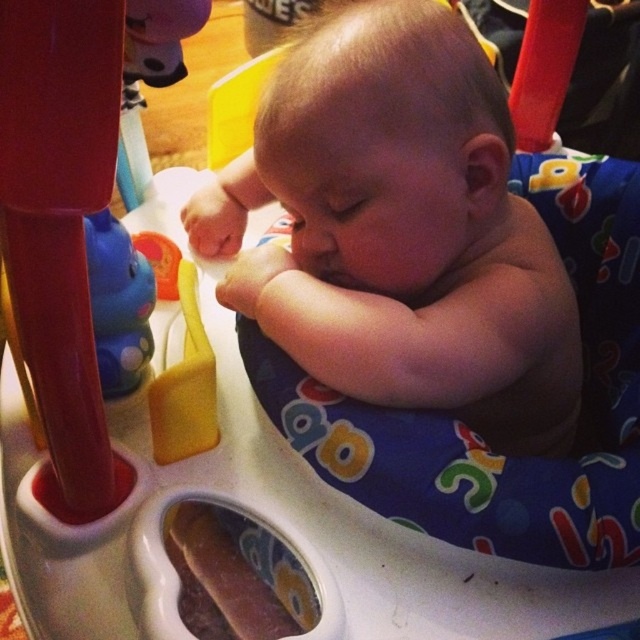
Can you confirm if blue rubber toy at left is shorter than rubberized plastic toy at left?

In fact, blue rubber toy at left may be taller than rubberized plastic toy at left.

Can you confirm if blue rubber toy at left is thinner than rubberized plastic toy at left?

Yes.

Which is behind, point (145, 355) or point (161, 298)?

The point (161, 298) is behind.

This screenshot has width=640, height=640. Identify the location of blue rubber toy at left. (118, 305).

Can you confirm if smooth skin baby at center is bigger than rubberized plastic toy at left?

Yes, smooth skin baby at center is bigger than rubberized plastic toy at left.

Does smooth skin baby at center have a greater width compared to rubberized plastic toy at left?

Indeed, smooth skin baby at center has a greater width compared to rubberized plastic toy at left.

Which is in front, point (372, 232) or point (154, 257)?

Point (372, 232)

Identify the location of smooth skin baby at center. (401, 230).

Which of these two, smooth skin baby at center or blue rubber toy at left, stands shorter?

With less height is blue rubber toy at left.

Is smooth skin baby at center to the left of blue rubber toy at left from the viewer's perspective?

In fact, smooth skin baby at center is to the right of blue rubber toy at left.

Who is more distant from viewer, (362, 362) or (112, 244)?

Point (112, 244)

The image size is (640, 640). What are the coordinates of `smooth skin baby at center` in the screenshot? It's located at (401, 230).